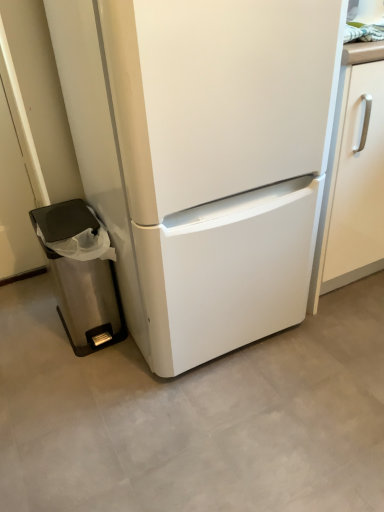
You are a GUI agent. You are given a task and a screenshot of the screen. Output one action in this format:
    pyautogui.click(x=<x>, y=<y>)
    Task: Click on the free space between white matte refrigerator at center and stainless steel trash can at left
    
    Given the screenshot: What is the action you would take?
    pyautogui.click(x=130, y=373)